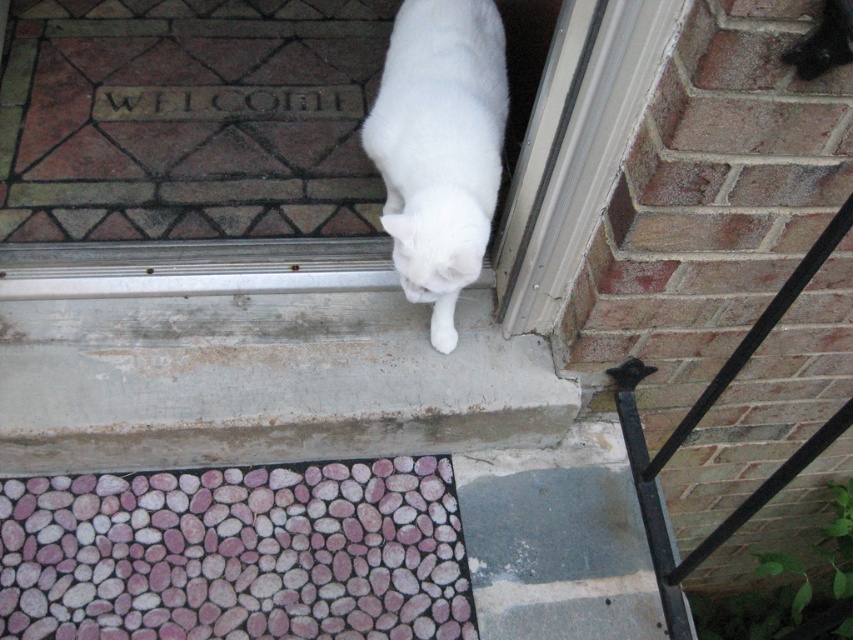
Question: From the image, what is the correct spatial relationship of pebble-patterned mat at lower left in relation to black metal rail at right?

Choices:
 (A) above
 (B) below

Answer: (B)

Question: Observing the image, what is the correct spatial positioning of smooth concrete step at center in reference to white fluffy cat at lower center?

Choices:
 (A) below
 (B) above

Answer: (A)

Question: Which of the following is the farthest from the observer?

Choices:
 (A) (498, 19)
 (B) (190, 472)
 (C) (236, 449)
 (D) (670, 435)

Answer: (D)

Question: Which of these objects is positioned closest to the smooth concrete step at center?

Choices:
 (A) black metal rail at right
 (B) pebble-patterned mat at lower left

Answer: (B)

Question: Can you confirm if pebble-patterned mat at lower left is positioned to the right of white fluffy cat at lower center?

Choices:
 (A) no
 (B) yes

Answer: (A)

Question: Which of the following is the closest to the observer?

Choices:
 (A) pebble-patterned mat at lower left
 (B) white fluffy cat at lower center
 (C) black metal rail at right

Answer: (C)